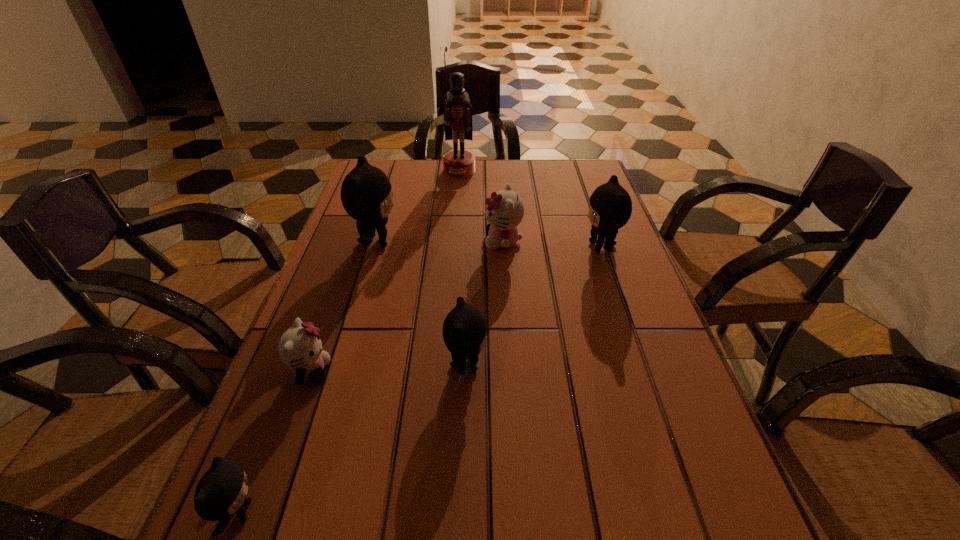
This screenshot has width=960, height=540. Find the location of `the nearer white kitten`. the nearer white kitten is located at coordinates click(x=300, y=348).

Identify the location of the left white kitten. The image size is (960, 540). (300, 348).

The image size is (960, 540). I want to click on vacant area situated on the front-facing side of the red nutcracker, so click(456, 213).

Identify the location of free space located on the front-facing side of the biggest gray kitten. (444, 242).

The image size is (960, 540). Find the location of `vacant space located 0.270m on the front-facing side of the rightmost object`. vacant space located 0.270m on the front-facing side of the rightmost object is located at coordinates (479, 247).

Find the location of `free space located on the front-facing side of the rightmost object`. free space located on the front-facing side of the rightmost object is located at coordinates (456, 247).

What are the coordinates of `free space located 0.230m on the front-facing side of the rightmost object` in the screenshot? It's located at (493, 247).

Where is `free space located 0.210m on the front-facing side of the right white kitten`? free space located 0.210m on the front-facing side of the right white kitten is located at coordinates (405, 241).

Find the location of a particular element. free location located on the front-facing side of the right white kitten is located at coordinates (364, 241).

Where is `free space located on the front-facing side of the right white kitten`? free space located on the front-facing side of the right white kitten is located at coordinates (x=401, y=241).